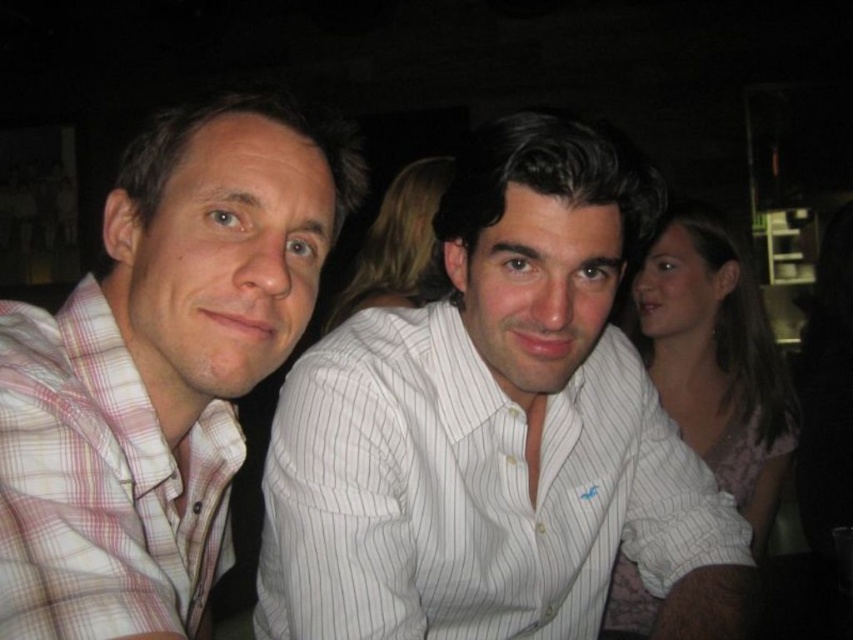
Question: Does pink plaid shirt at left have a larger size compared to plaid cotton shirt at left?

Choices:
 (A) no
 (B) yes

Answer: (B)

Question: Which of the following is the closest to the observer?

Choices:
 (A) plaid cotton shirt at left
 (B) white striped shirt at center

Answer: (A)

Question: Which of the following is the farthest from the observer?

Choices:
 (A) plaid cotton shirt at left
 (B) pink plaid shirt at left
 (C) white striped shirt at center

Answer: (C)

Question: Is white striped shirt at center to the right of pink plaid shirt at left from the viewer's perspective?

Choices:
 (A) no
 (B) yes

Answer: (B)

Question: Which object is farther from the camera taking this photo?

Choices:
 (A) plaid cotton shirt at left
 (B) white striped shirt at center
 (C) pink plaid shirt at left

Answer: (B)

Question: Can you confirm if pink plaid shirt at left is positioned above plaid cotton shirt at left?

Choices:
 (A) yes
 (B) no

Answer: (A)